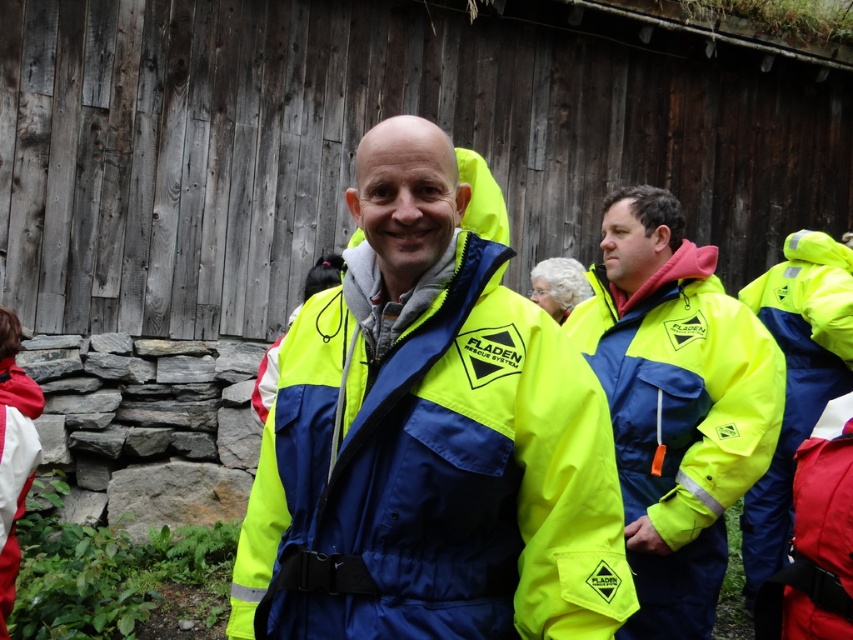
Question: Where is neon yellow fabric safety vest at right located in relation to matte red safety vest at lower right in the image?

Choices:
 (A) left
 (B) right

Answer: (B)

Question: Is neon yellow jacket at center in front of matte red safety vest at lower right?

Choices:
 (A) yes
 (B) no

Answer: (A)

Question: Which object appears farthest from the camera in this image?

Choices:
 (A) matte red safety vest at lower right
 (B) neon yellow jacket at center
 (C) neon yellow fabric safety vest at right
 (D) matte yellow jacket at right

Answer: (C)

Question: Can you confirm if matte yellow jacket at right is thinner than neon yellow fabric safety vest at right?

Choices:
 (A) no
 (B) yes

Answer: (A)

Question: Considering the real-world distances, which object is farthest from the neon yellow fabric safety vest at right?

Choices:
 (A) matte yellow jacket at right
 (B) matte red safety vest at lower right
 (C) neon yellow jacket at center

Answer: (C)

Question: Which of the following is the closest to the observer?

Choices:
 (A) matte red safety vest at lower right
 (B) matte yellow jacket at right
 (C) neon yellow fabric safety vest at right
 (D) neon yellow jacket at center

Answer: (D)